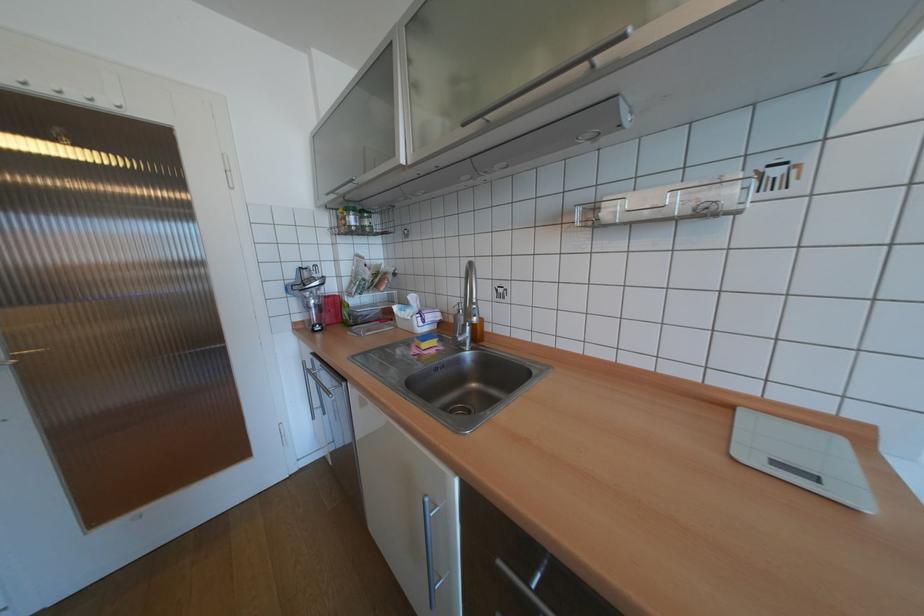
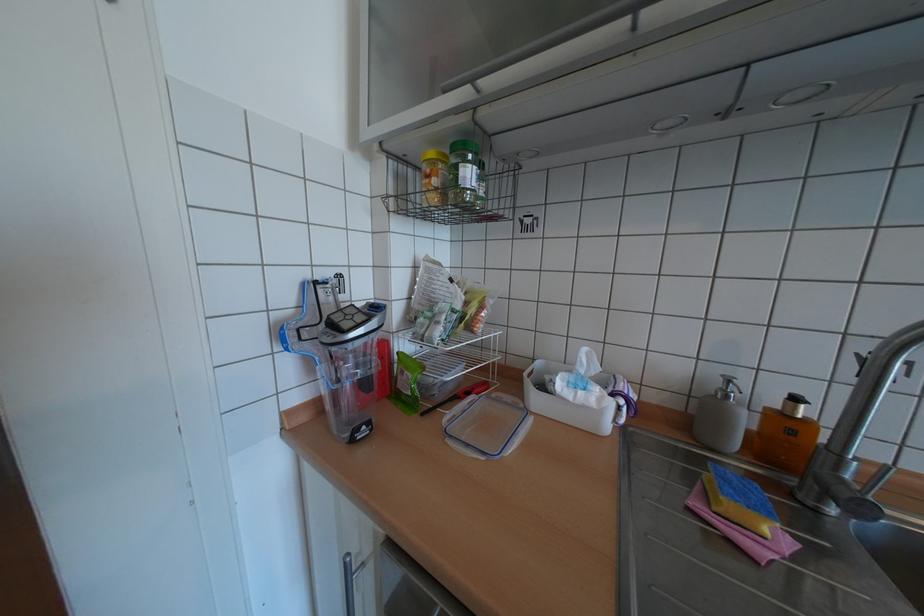
In the second image, find the point that corresponds to [391,322] in the first image.

(487, 394)